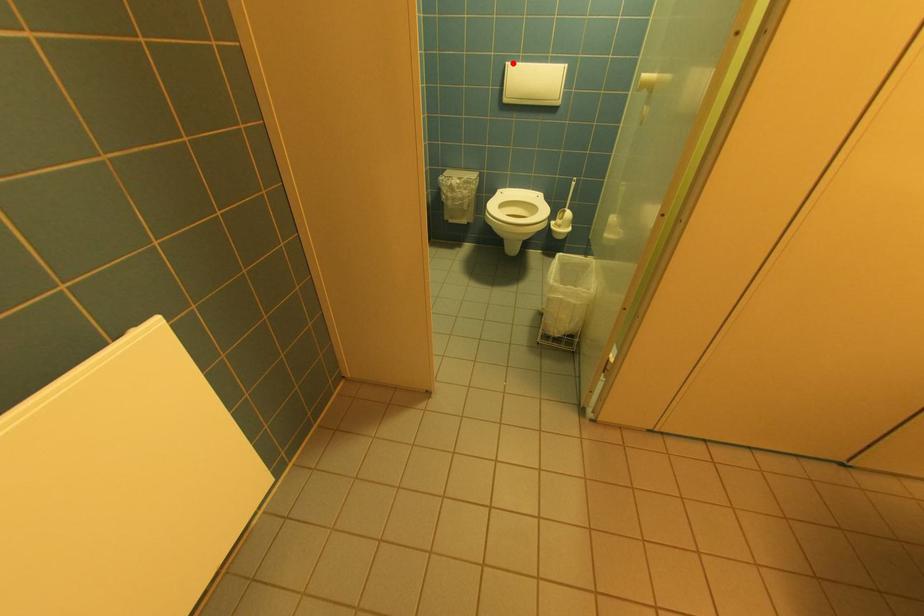
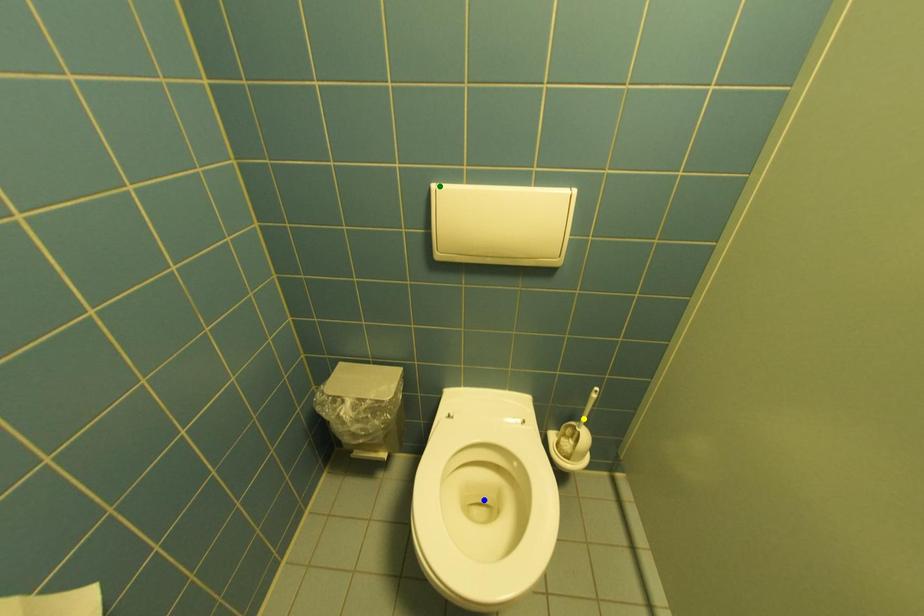
Question: I am providing you with two images of the same scene from different viewpoints. A red point is marked on the first image. You are given multiple points on the second image. In image 2, which mark is for the same physical point as the one in image 1?

Choices:
 (A) blue point
 (B) yellow point
 (C) green point

Answer: (C)